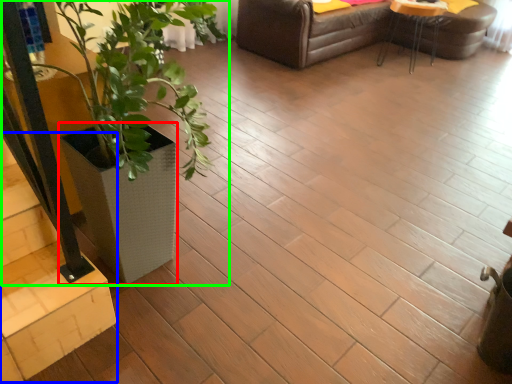
Question: Considering the real-world distances, which object is closest to flowerpot (highlighted by a red box)? stairwell (highlighted by a blue box) or houseplant (highlighted by a green box).

Choices:
 (A) stairwell
 (B) houseplant

Answer: (B)